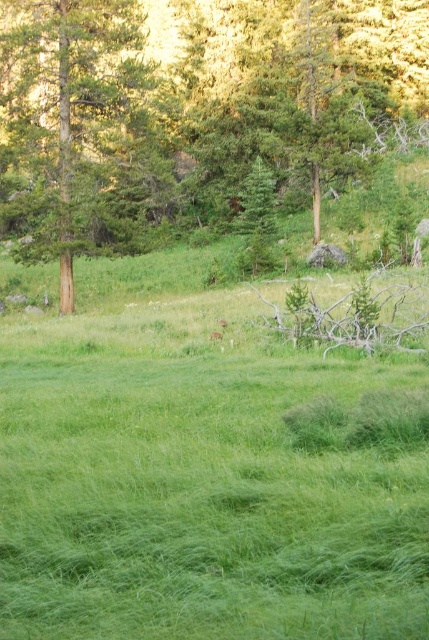
Is brown wood tree at center to the right of green textured tree at left from the viewer's perspective?

Yes, brown wood tree at center is to the right of green textured tree at left.

Between brown wood tree at center and green textured tree at left, which one appears on the right side from the viewer's perspective?

brown wood tree at center

Who is more forward, (36, 166) or (73, 104)?

Point (36, 166) is in front.

Where is `brown wood tree at center`? This screenshot has width=429, height=640. brown wood tree at center is located at coordinates (187, 113).